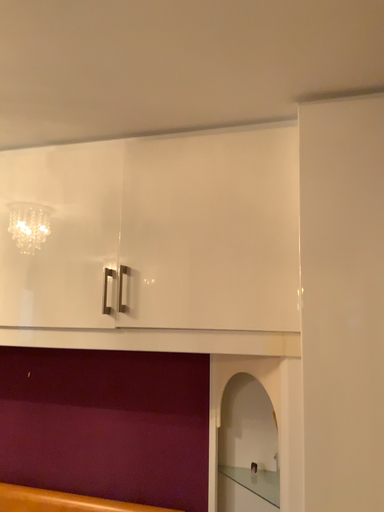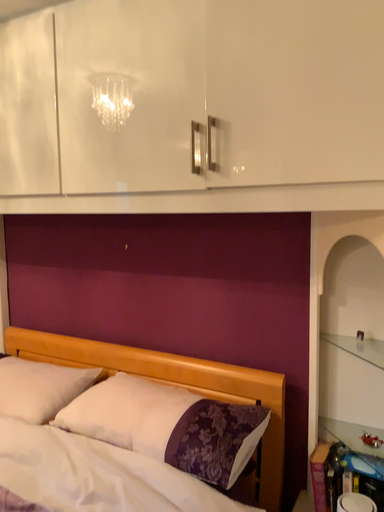
Question: How did the camera likely rotate when shooting the video?

Choices:
 (A) rotated left
 (B) rotated right

Answer: (A)